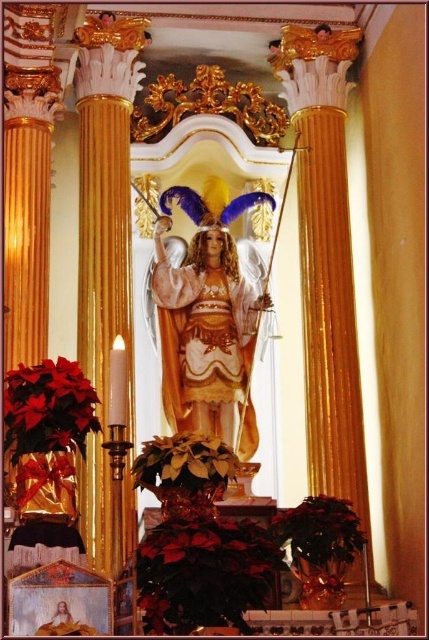
Question: Is shiny red poinsettia at lower left thinner than green matte poinsettia at lower right?

Choices:
 (A) yes
 (B) no

Answer: (A)

Question: Which point is closer to the camera?

Choices:
 (A) gold textured statue at center
 (B) green matte poinsettia at lower right
 (C) green leafy plant at center

Answer: (C)

Question: Is shiny red poinsettia at lower left above green matte poinsettia at lower right?

Choices:
 (A) no
 (B) yes

Answer: (B)

Question: Which point is closer to the camera?

Choices:
 (A) (238, 368)
 (B) (156, 451)

Answer: (B)

Question: Can you confirm if shiny red poinsettia at lower left is smaller than green leafy plant at center?

Choices:
 (A) no
 (B) yes

Answer: (A)

Question: Which is nearer to the gold textured statue at center?

Choices:
 (A) green leafy plant at center
 (B) green matte poinsettia at lower right
 (C) shiny red poinsettia at lower left

Answer: (B)